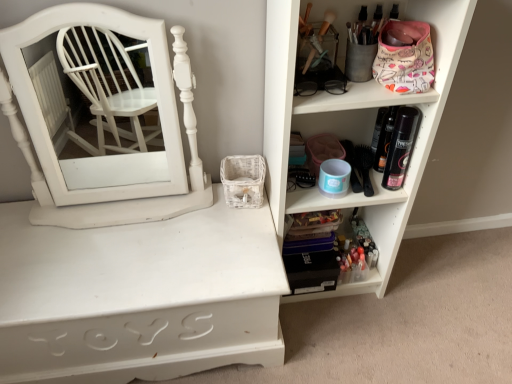
Locate an element on the screen. free space in front of white plastic shelf at upper right, placed as the third shelf when sorted from left to right is located at coordinates (352, 341).